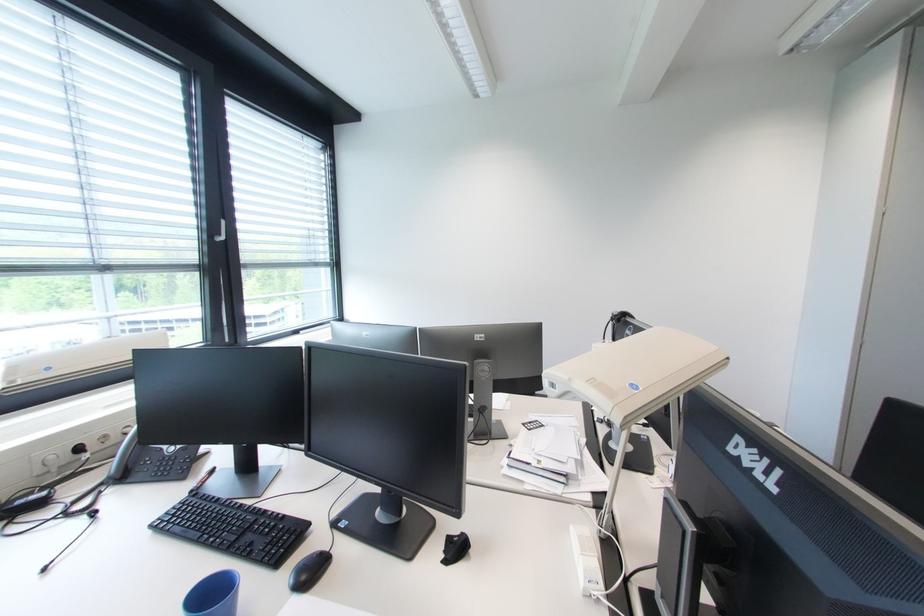
Find the location of a particular element. telephone handset is located at coordinates (122, 456).